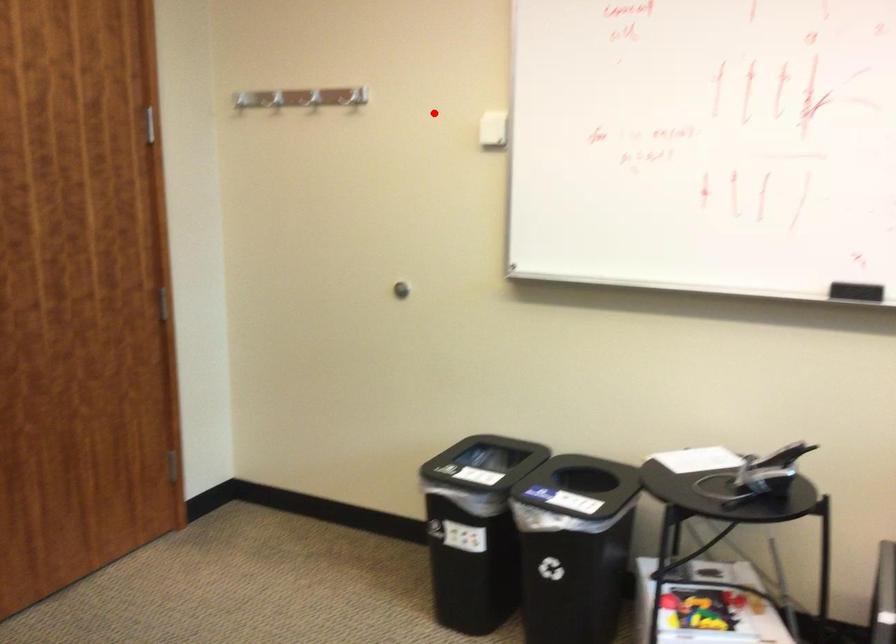
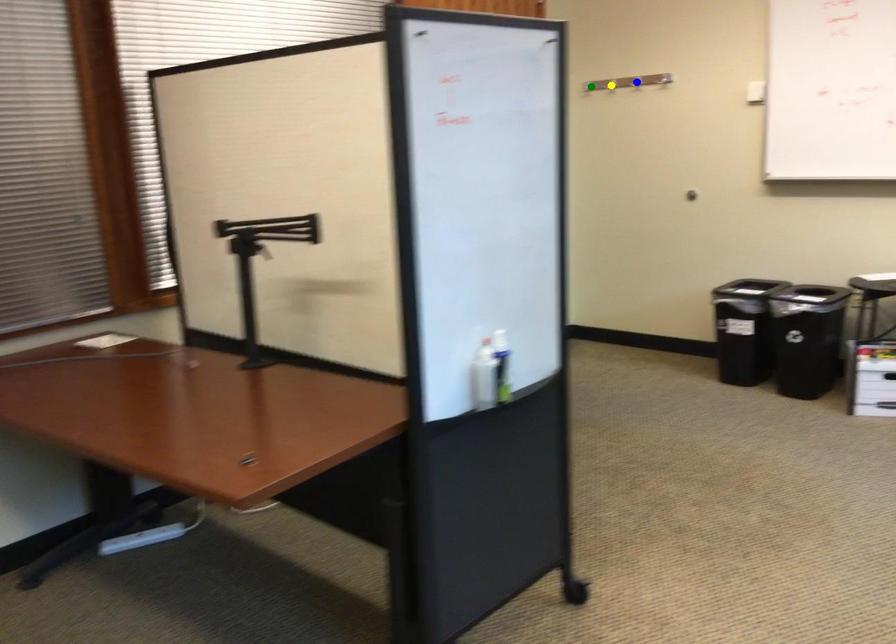
Question: I am providing you with two images of the same scene from different viewpoints. A red point is marked on the first image. You are given multiple points on the second image. Which mark in image 2 goes with the point in image 1?

Choices:
 (A) blue point
 (B) green point
 (C) yellow point

Answer: (A)